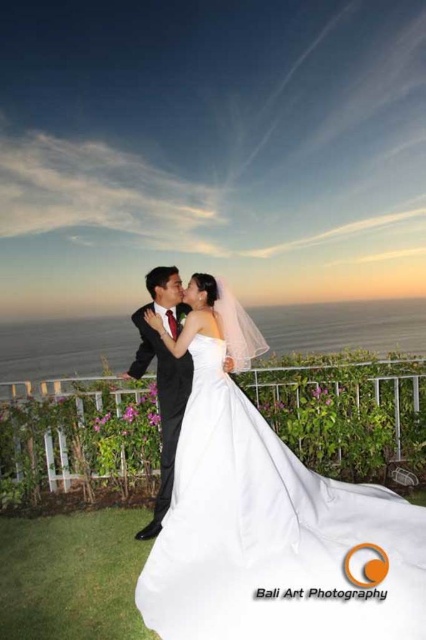
Question: Is white satin dress at center behind black satin suit at center?

Choices:
 (A) no
 (B) yes

Answer: (A)

Question: Can you confirm if white satin dress at center is thinner than black satin suit at center?

Choices:
 (A) no
 (B) yes

Answer: (A)

Question: Which point is farther to the camera?

Choices:
 (A) black satin suit at center
 (B) white satin dress at center

Answer: (A)

Question: Is white satin dress at center further to the viewer compared to black satin suit at center?

Choices:
 (A) yes
 (B) no

Answer: (B)

Question: Which point is farther from the camera taking this photo?

Choices:
 (A) 290,588
 (B) 138,376

Answer: (B)

Question: Which of the following is the closest to the observer?

Choices:
 (A) (160, 548)
 (B) (175, 332)

Answer: (A)